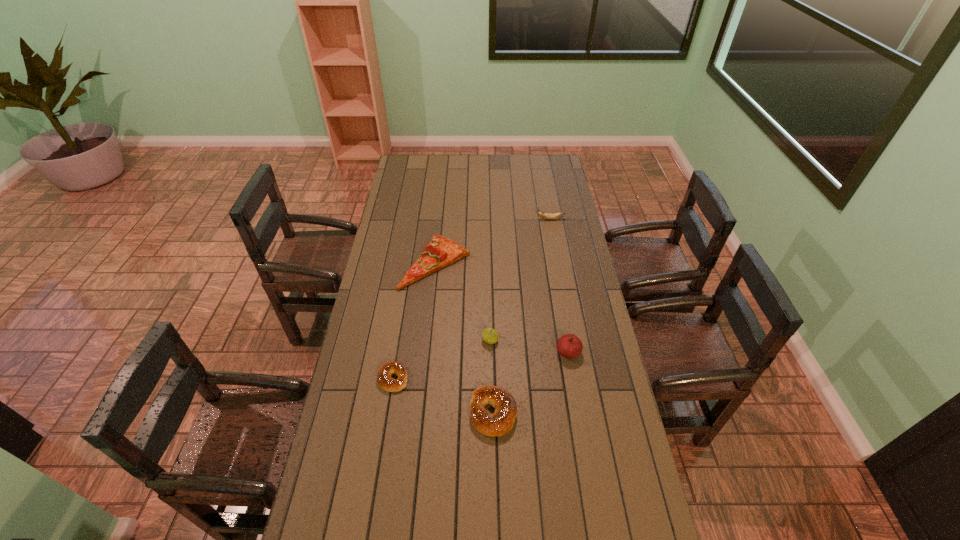
Find the location of a particular element. the shortest object is located at coordinates (384, 378).

This screenshot has height=540, width=960. Find the location of `the shorter bagel`. the shorter bagel is located at coordinates (384, 378).

Identify the location of the fourth tallest object. The height and width of the screenshot is (540, 960). (501, 422).

Find the location of a particular element. The width and height of the screenshot is (960, 540). the taller bagel is located at coordinates (501, 422).

Identify the location of the farthest object. The image size is (960, 540). (543, 215).

Where is `tomato`? The width and height of the screenshot is (960, 540). tomato is located at coordinates (570, 346).

The height and width of the screenshot is (540, 960). Identify the location of the fifth nearest object. (440, 252).

You are a GUI agent. You are given a task and a screenshot of the screen. Output one action in this format:
    pyautogui.click(x=<x>, y=<y>)
    Task: Click on the second shortest object
    The image size is (960, 540).
    Given the screenshot: What is the action you would take?
    pyautogui.click(x=440, y=252)

The height and width of the screenshot is (540, 960). Find the location of `pear`. pear is located at coordinates (489, 335).

Identify the location of free location located on the front of the shorter bagel. This screenshot has height=540, width=960. (371, 518).